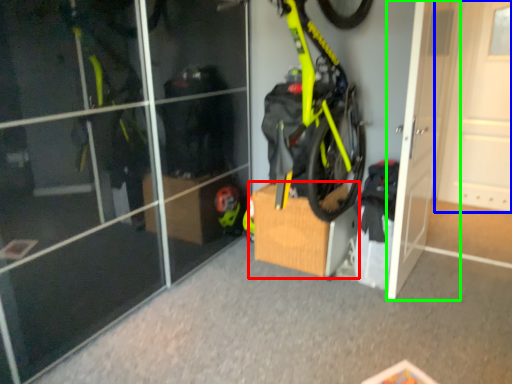
Question: Which object is positioned closest to cardboard box (highlighted by a red box)? Select from door (highlighted by a blue box) and door (highlighted by a green box).

Choices:
 (A) door
 (B) door

Answer: (B)